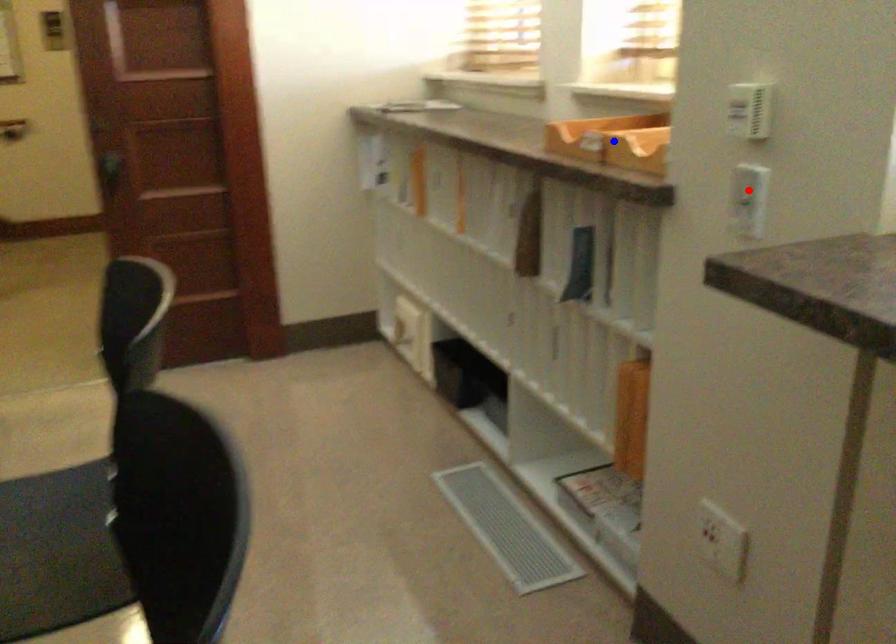
Question: In the image, two points are highlighted. Which point is nearer to the camera? Reply with the corresponding letter.

Choices:
 (A) blue point
 (B) red point

Answer: (B)